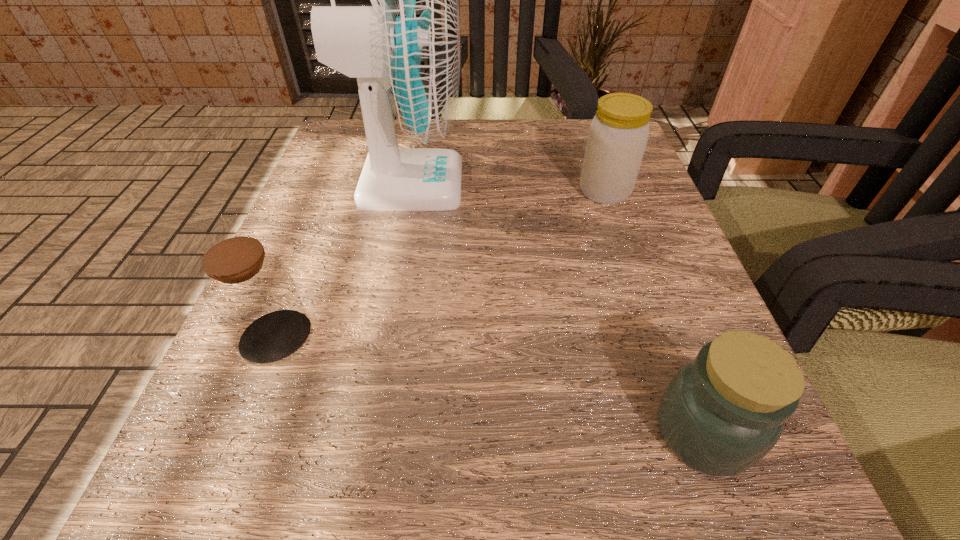
Find the location of a particular element. fan is located at coordinates tap(404, 50).

You are a GUI agent. You are given a task and a screenshot of the screen. Output one action in this format:
    pyautogui.click(x=<x>, y=<y>)
    Task: Click on the farthest jar
    This screenshot has height=540, width=960.
    Given the screenshot: What is the action you would take?
    pyautogui.click(x=618, y=134)

Where is `the second nearest object`? The width and height of the screenshot is (960, 540). the second nearest object is located at coordinates click(x=251, y=293).

Find the location of a particular element. This screenshot has width=960, height=540. the second farthest jar is located at coordinates (251, 293).

In order to click on the nearest jar in this screenshot , I will do `click(722, 412)`.

Image resolution: width=960 pixels, height=540 pixels. Identify the location of free space located in front of the fan to face the airflow. (516, 184).

Find the location of `free space located on the front of the farthest jar`. free space located on the front of the farthest jar is located at coordinates (679, 412).

Identify the location of blank space located on the back of the second nearest jar. (302, 269).

I want to click on vacant space located 0.150m on the back of the nearest object, so 653,296.

At what (x,y) coordinates should I click in order to perform the action: click on fan present at the far edge. Please return your answer as a coordinate pair (x, y). Looking at the image, I should click on (404, 50).